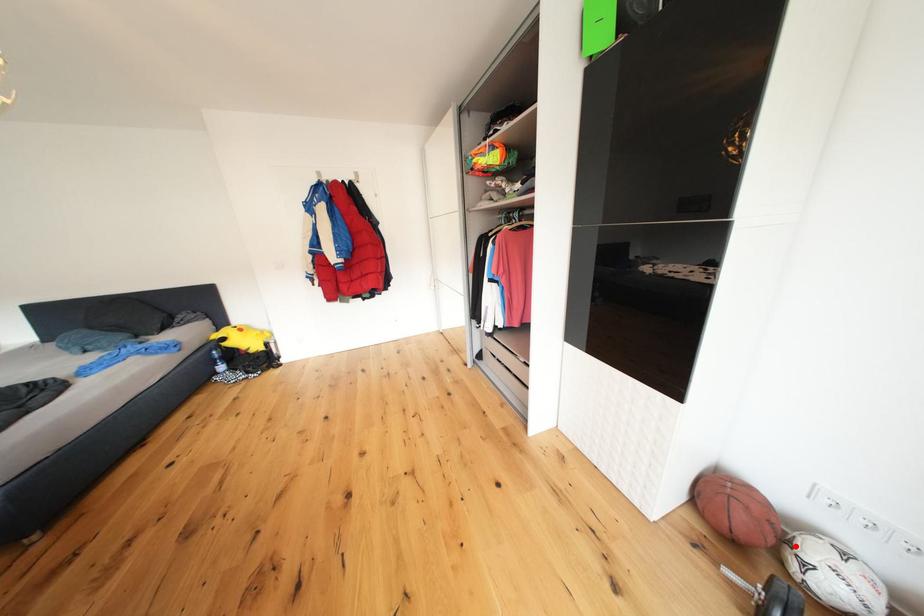
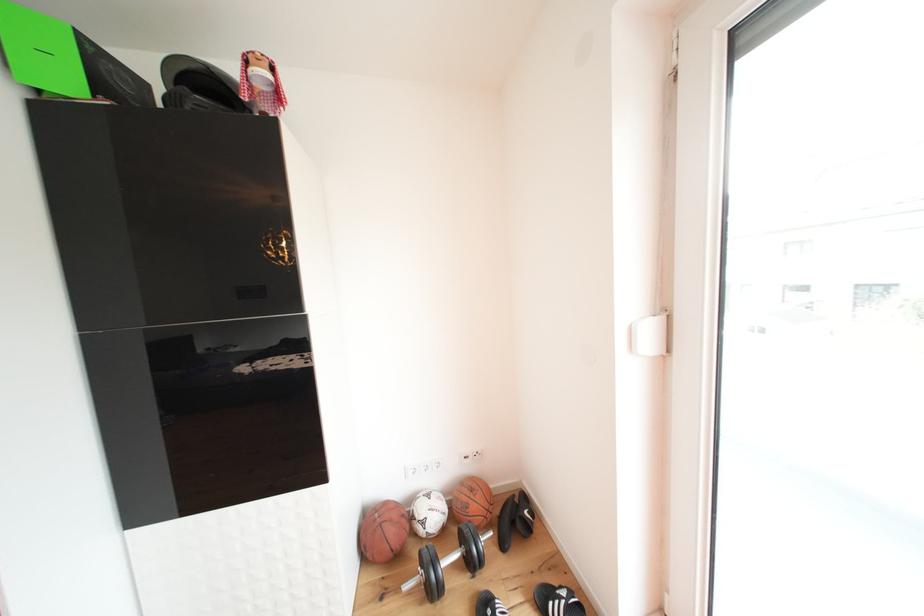
Find the pixel in the second image that matches the highlighted location in the first image.

(420, 523)